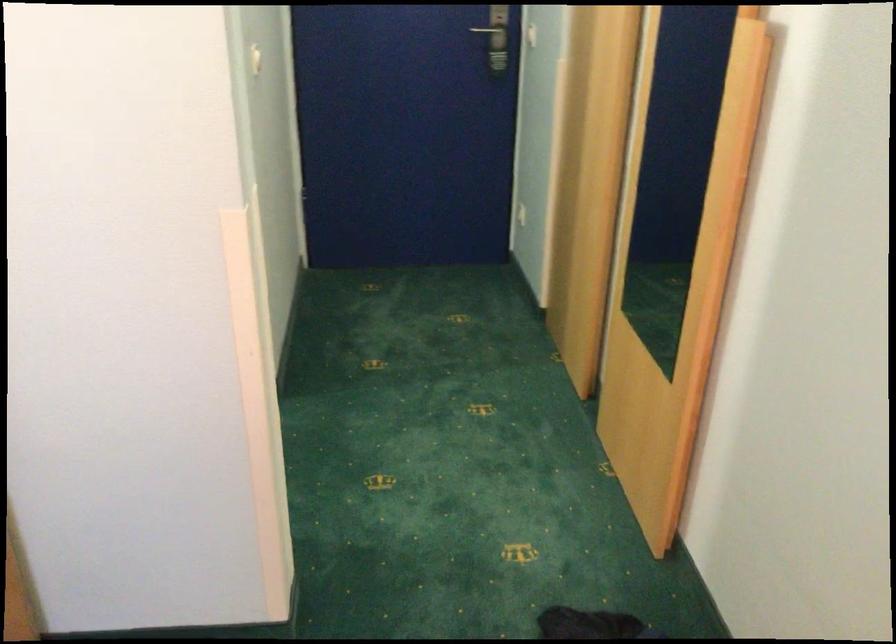
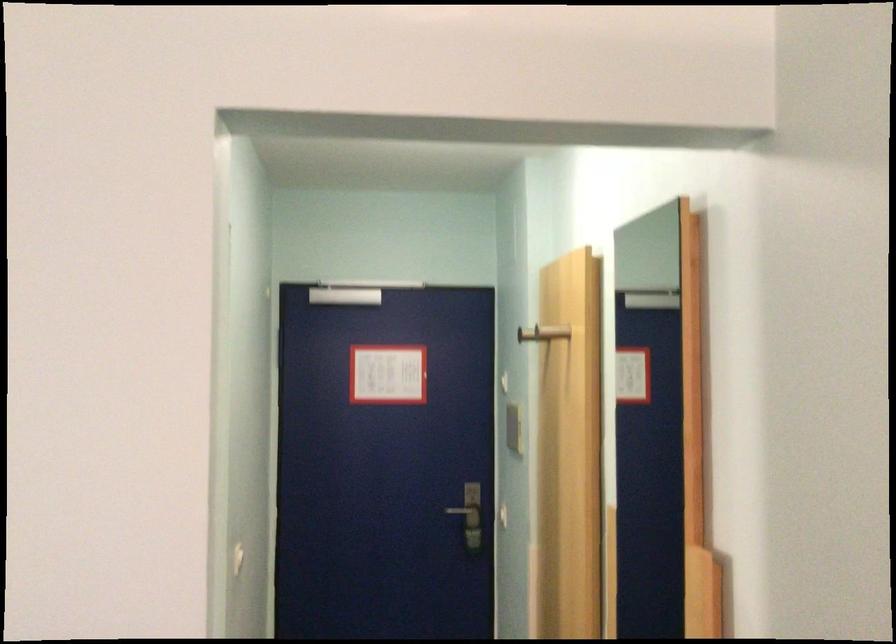
Question: How did the camera likely rotate?

Choices:
 (A) Left
 (B) Right
 (C) Up
 (D) Down

Answer: (C)